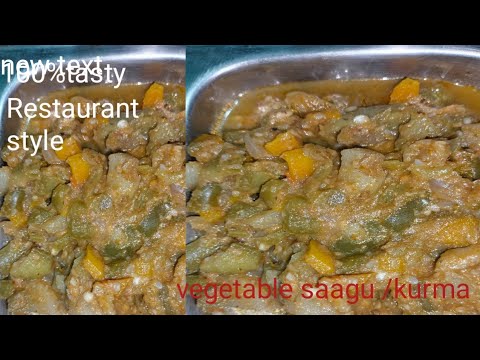
This screenshot has height=360, width=480. What are the coordinates of `dish edge` in the screenshot? It's located at click(136, 67), click(214, 78).